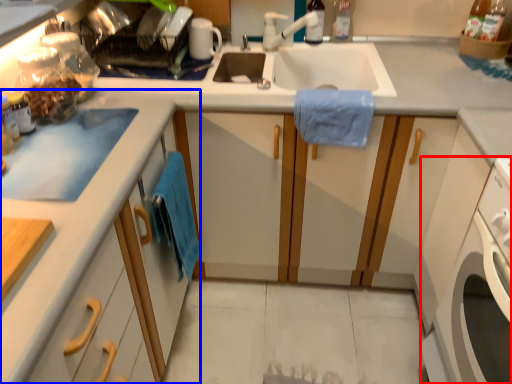
Question: Which object appears closest to the camera in this image, washing machine (highlighted by a red box) or cabinetry (highlighted by a blue box)?

Choices:
 (A) washing machine
 (B) cabinetry

Answer: (B)